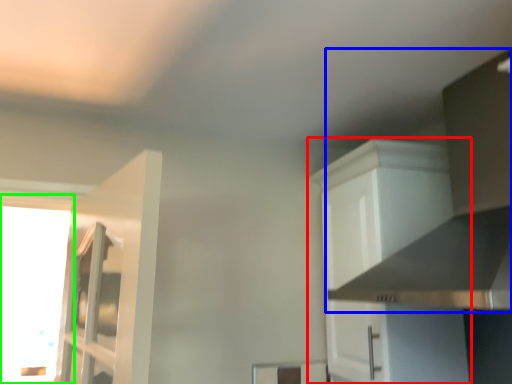
Question: Considering the real-world distances, which object is farthest from cabinetry (highlighted by a red box)? vent (highlighted by a blue box) or window (highlighted by a green box)?

Choices:
 (A) vent
 (B) window

Answer: (B)